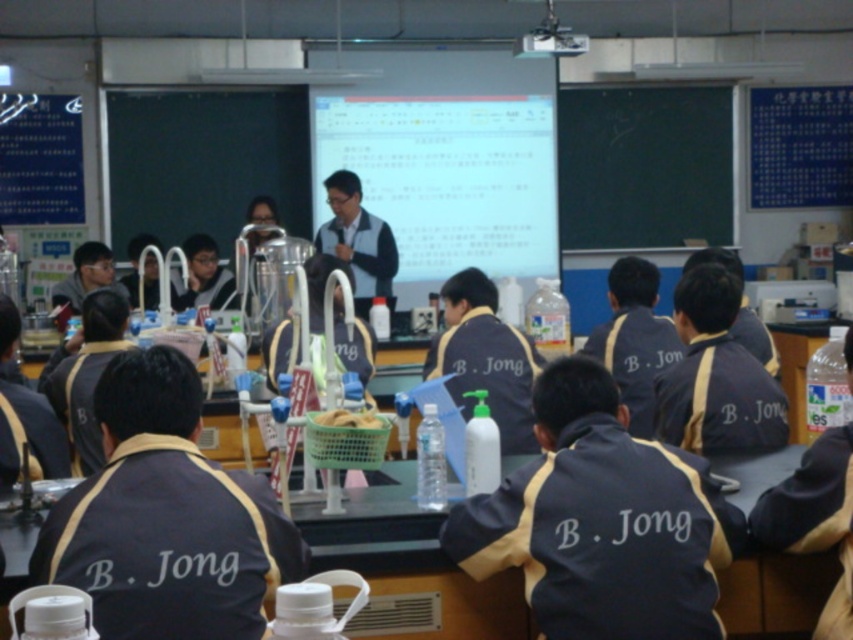
Does point (676, 620) come closer to viewer compared to point (619, 228)?

Yes.

The image size is (853, 640). In order to click on white matte bottle at center in this screenshot , I will do `click(601, 522)`.

Between dark blue fabric at center and black chalkboard at upper center, which one has more height?

With more height is black chalkboard at upper center.

Is dark blue fabric at center wider than black chalkboard at upper center?

No.

At what (x,y) coordinates should I click in order to perform the action: click on dark blue fabric at center. Please return your answer as a coordinate pair (x, y). The image size is (853, 640). Looking at the image, I should click on (166, 516).

Who is positioned more to the left, white matte bottle at center or dark blue fabric at center?

From the viewer's perspective, dark blue fabric at center appears more on the left side.

Does white matte bottle at center appear on the right side of dark blue fabric at center?

Correct, you'll find white matte bottle at center to the right of dark blue fabric at center.

Between point (550, 384) and point (44, 579), which one is positioned behind?

The point (550, 384) is behind.

Identify the location of white matte bottle at center. The width and height of the screenshot is (853, 640). (601, 522).